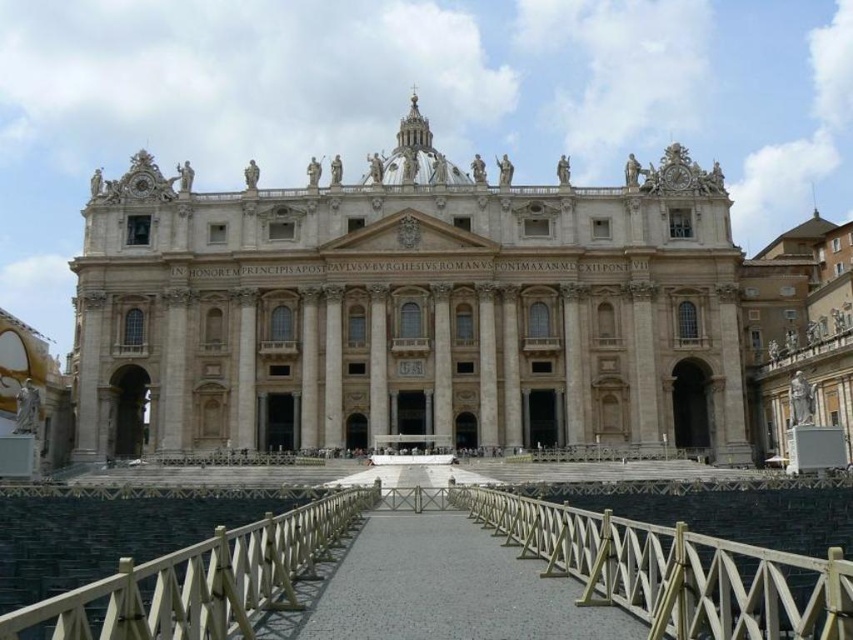
Question: Does smooth concrete walkway at center have a greater width compared to wooden at center?

Choices:
 (A) yes
 (B) no

Answer: (A)

Question: Observing the image, what is the correct spatial positioning of gold metallic rail at center in reference to smooth concrete walkway at center?

Choices:
 (A) right
 (B) left

Answer: (A)

Question: Considering the real-world distances, which object is closest to the smooth concrete walkway at center?

Choices:
 (A) beige stone church at center
 (B) wooden at center
 (C) gold metallic rail at center

Answer: (C)

Question: Based on their relative distances, which object is farther from the wooden at center?

Choices:
 (A) gold metallic rail at center
 (B) smooth concrete walkway at center
 (C) beige stone church at center

Answer: (C)

Question: Does smooth concrete walkway at center have a smaller size compared to wooden at center?

Choices:
 (A) yes
 (B) no

Answer: (A)

Question: Which object appears closest to the camera in this image?

Choices:
 (A) beige stone church at center
 (B) smooth concrete walkway at center

Answer: (B)